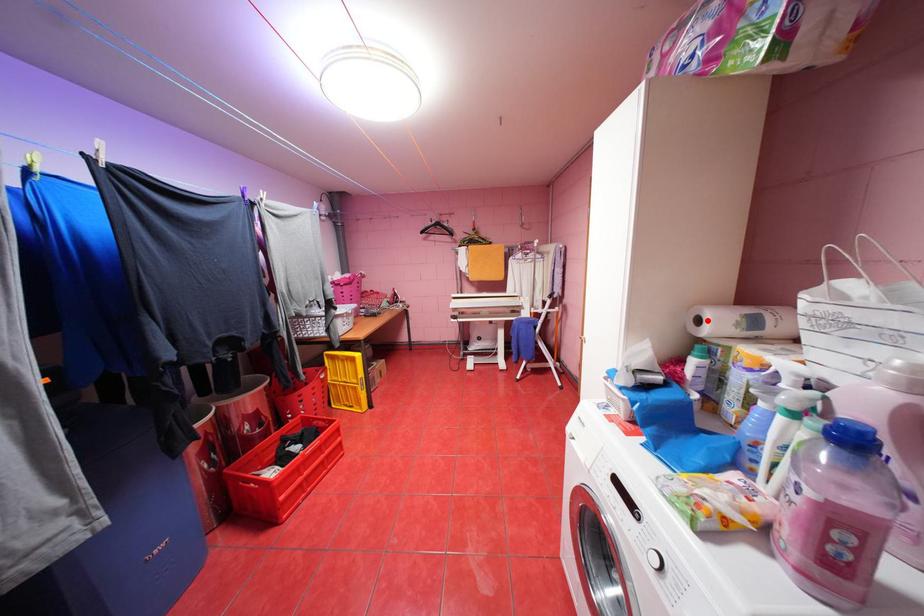
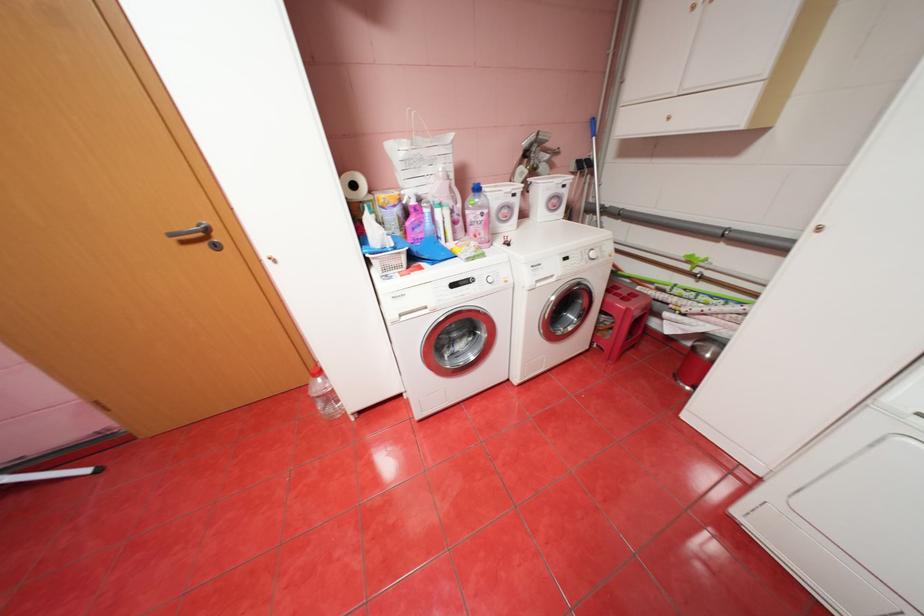
Find the pixel in the second image that matches the highlighted location in the first image.

(362, 185)